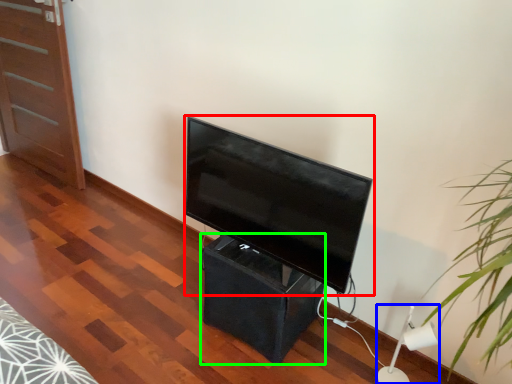
Question: Considering the real-world distances, which object is closest to television (highlighted by a red box)? lamp (highlighted by a blue box) or table (highlighted by a green box).

Choices:
 (A) lamp
 (B) table

Answer: (B)